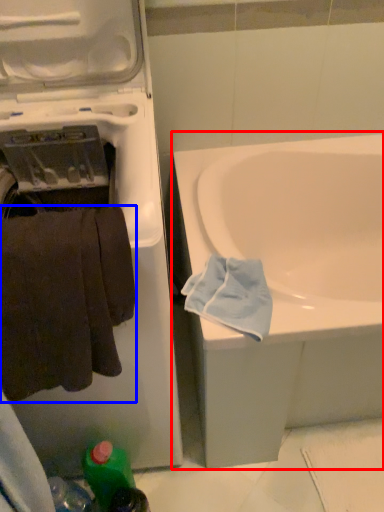
Question: Which object is closer to the camera taking this photo, bathtub (highlighted by a red box) or towel (highlighted by a blue box)?

Choices:
 (A) bathtub
 (B) towel

Answer: (B)